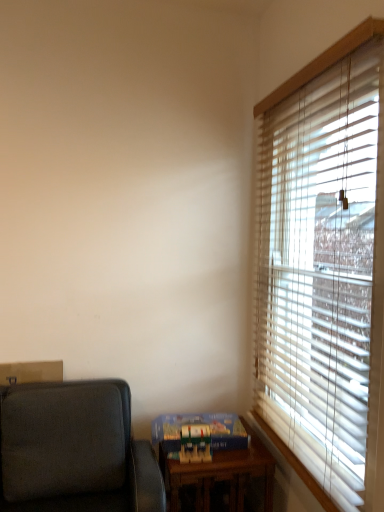
In order to click on wooden blinds at right in this screenshot , I will do `click(323, 268)`.

The image size is (384, 512). In order to click on dark gray fabric studio couch at lower left in this screenshot , I will do `click(74, 450)`.

You are a GUI agent. You are given a task and a screenshot of the screen. Output one action in this format:
    pyautogui.click(x=<x>, y=<y>)
    Task: Click on the wooden table at lower center
    
    Given the screenshot: What is the action you would take?
    pos(221,474)

The width and height of the screenshot is (384, 512). Find the location of `hardcover book at lower right, the 1th paperback book viewed from the front`. hardcover book at lower right, the 1th paperback book viewed from the front is located at coordinates (195, 443).

At what (x,y) coordinates should I click in order to perform the action: click on wooden blinds at right. Please return your answer as a coordinate pair (x, y). Looking at the image, I should click on (323, 268).

Based on their positions, is wooden blinds at right located to the left or right of hardcover book at lower right, placed as the 2th paperback book when sorted from back to front?

In the image, wooden blinds at right appears on the right side of hardcover book at lower right, placed as the 2th paperback book when sorted from back to front.

Is wooden blinds at right directly adjacent to hardcover book at lower right, the 1th paperback book viewed from the front?

No, wooden blinds at right is not with hardcover book at lower right, the 1th paperback book viewed from the front.

The height and width of the screenshot is (512, 384). I want to click on paperback book that is the 1st object located behind the wooden blinds at right, so click(x=195, y=443).

Between point (321, 286) and point (184, 462), which one is positioned in front?

The point (321, 286) is more forward.

Where is `paperback book that is the 2nd object located behind the wooden table at lower center`? paperback book that is the 2nd object located behind the wooden table at lower center is located at coordinates 200,423.

Can you tell me how much blue cardboard game set at lower center, the second paperback book viewed from the front, and wooden table at lower center differ in facing direction?

There is a 8.65e-05-degree angle between the facing directions of blue cardboard game set at lower center, the second paperback book viewed from the front, and wooden table at lower center.

Could you tell me if blue cardboard game set at lower center, marked as the first paperback book in a back-to-front arrangement, is turned towards wooden table at lower center?

No, blue cardboard game set at lower center, marked as the first paperback book in a back-to-front arrangement, does not turn towards wooden table at lower center.

From the image's perspective, who appears lower, blue cardboard game set at lower center, the second paperback book viewed from the front, or wooden table at lower center?

From the image's view, wooden table at lower center is below.

From the image's perspective, between dark gray fabric studio couch at lower left and wooden table at lower center, which one is located above?

dark gray fabric studio couch at lower left is shown above in the image.

Is wooden table at lower center inside dark gray fabric studio couch at lower left?

No.

Can you tell me how much dark gray fabric studio couch at lower left and wooden table at lower center differ in facing direction?

0.271 degrees.

Considering the sizes of objects dark gray fabric studio couch at lower left and wooden table at lower center in the image provided, who is wider, dark gray fabric studio couch at lower left or wooden table at lower center?

With larger width is wooden table at lower center.

Considering the sizes of wooden table at lower center and dark gray fabric studio couch at lower left in the image, is wooden table at lower center wider or thinner than dark gray fabric studio couch at lower left?

Considering their sizes, wooden table at lower center looks broader than dark gray fabric studio couch at lower left.

In the image, is wooden table at lower center on the left side or the right side of dark gray fabric studio couch at lower left?

Clearly, wooden table at lower center is on the right of dark gray fabric studio couch at lower left in the image.

From the image's perspective, is wooden table at lower center over dark gray fabric studio couch at lower left?

Actually, wooden table at lower center appears below dark gray fabric studio couch at lower left in the image.

Is hardcover book at lower right, the 1th paperback book viewed from the front, in front of blue cardboard game set at lower center, the second paperback book viewed from the front?

Yes, hardcover book at lower right, the 1th paperback book viewed from the front, is in front of blue cardboard game set at lower center, the second paperback book viewed from the front.

Is hardcover book at lower right, the 1th paperback book viewed from the front, touching blue cardboard game set at lower center, the second paperback book viewed from the front?

Yes, the surface of hardcover book at lower right, the 1th paperback book viewed from the front, is in contact with blue cardboard game set at lower center, the second paperback book viewed from the front.

From the image's perspective, is hardcover book at lower right, placed as the 2th paperback book when sorted from back to front, below blue cardboard game set at lower center, the second paperback book viewed from the front?

No, from the image's perspective, hardcover book at lower right, placed as the 2th paperback book when sorted from back to front, is not below blue cardboard game set at lower center, the second paperback book viewed from the front.

From the picture: Which object is thinner, hardcover book at lower right, the 1th paperback book viewed from the front, or blue cardboard game set at lower center, marked as the first paperback book in a back-to-front arrangement?

With smaller width is hardcover book at lower right, the 1th paperback book viewed from the front.

Which of these two, blue cardboard game set at lower center, the second paperback book viewed from the front, or hardcover book at lower right, placed as the 2th paperback book when sorted from back to front, stands shorter?

Standing shorter between the two is blue cardboard game set at lower center, the second paperback book viewed from the front.

Image resolution: width=384 pixels, height=512 pixels. I want to click on paperback book that appears in front of the blue cardboard game set at lower center, the second paperback book viewed from the front, so click(195, 443).

Does blue cardboard game set at lower center, marked as the first paperback book in a back-to-front arrangement, have a lesser width compared to hardcover book at lower right, placed as the 2th paperback book when sorted from back to front?

Incorrect, the width of blue cardboard game set at lower center, marked as the first paperback book in a back-to-front arrangement, is not less than that of hardcover book at lower right, placed as the 2th paperback book when sorted from back to front.

Does blue cardboard game set at lower center, marked as the first paperback book in a back-to-front arrangement, have a larger size compared to hardcover book at lower right, placed as the 2th paperback book when sorted from back to front?

Correct, blue cardboard game set at lower center, marked as the first paperback book in a back-to-front arrangement, is larger in size than hardcover book at lower right, placed as the 2th paperback book when sorted from back to front.

Between wooden table at lower center and blue cardboard game set at lower center, marked as the first paperback book in a back-to-front arrangement, which one appears on the left side from the viewer's perspective?

blue cardboard game set at lower center, marked as the first paperback book in a back-to-front arrangement, is more to the left.

From a real-world perspective, is wooden table at lower center physically located above or below blue cardboard game set at lower center, marked as the first paperback book in a back-to-front arrangement?

Clearly, from a real-world perspective, wooden table at lower center is below blue cardboard game set at lower center, marked as the first paperback book in a back-to-front arrangement.

Is wooden table at lower center positioned far away from blue cardboard game set at lower center, marked as the first paperback book in a back-to-front arrangement?

They are positioned close to each other.

From the image's perspective, which is above, wooden table at lower center or blue cardboard game set at lower center, marked as the first paperback book in a back-to-front arrangement?

blue cardboard game set at lower center, marked as the first paperback book in a back-to-front arrangement, from the image's perspective.

Locate an element on the screen. paperback book that is the 1st object located below the wooden blinds at right (from the image's perspective) is located at coordinates (195, 443).

Identify the location of the 2nd paperback book behind the wooden table at lower center. The width and height of the screenshot is (384, 512). (200, 423).

Which object lies further to the anchor point hardcover book at lower right, placed as the 2th paperback book when sorted from back to front, blue cardboard game set at lower center, marked as the first paperback book in a back-to-front arrangement, or dark gray fabric studio couch at lower left?

The object further to hardcover book at lower right, placed as the 2th paperback book when sorted from back to front, is dark gray fabric studio couch at lower left.

From the image, which object appears to be farther from wooden table at lower center, wooden blinds at right or hardcover book at lower right, placed as the 2th paperback book when sorted from back to front?

Based on the image, wooden blinds at right appears to be further to wooden table at lower center.

From the image, which object appears to be farther from blue cardboard game set at lower center, the second paperback book viewed from the front, hardcover book at lower right, placed as the 2th paperback book when sorted from back to front, or wooden table at lower center?

wooden table at lower center is further to blue cardboard game set at lower center, the second paperback book viewed from the front.

Looking at the image, which one is located closer to wooden table at lower center, hardcover book at lower right, placed as the 2th paperback book when sorted from back to front, or dark gray fabric studio couch at lower left?

hardcover book at lower right, placed as the 2th paperback book when sorted from back to front.

Which object lies further to the anchor point blue cardboard game set at lower center, the second paperback book viewed from the front, dark gray fabric studio couch at lower left or hardcover book at lower right, the 1th paperback book viewed from the front?

dark gray fabric studio couch at lower left.

Estimate the real-world distances between objects in this image. Which object is further from hardcover book at lower right, the 1th paperback book viewed from the front, wooden table at lower center or wooden blinds at right?

The object further to hardcover book at lower right, the 1th paperback book viewed from the front, is wooden blinds at right.

Considering their positions, is wooden table at lower center positioned closer to hardcover book at lower right, the 1th paperback book viewed from the front, than blue cardboard game set at lower center, marked as the first paperback book in a back-to-front arrangement?

The object closer to hardcover book at lower right, the 1th paperback book viewed from the front, is blue cardboard game set at lower center, marked as the first paperback book in a back-to-front arrangement.

Estimate the real-world distances between objects in this image. Which object is closer to wooden table at lower center, hardcover book at lower right, placed as the 2th paperback book when sorted from back to front, or blue cardboard game set at lower center, marked as the first paperback book in a back-to-front arrangement?

The object closer to wooden table at lower center is blue cardboard game set at lower center, marked as the first paperback book in a back-to-front arrangement.

The image size is (384, 512). Find the location of `paperback book that lies between wooden blinds at right and blue cardboard game set at lower center, the second paperback book viewed from the front, from top to bottom`. paperback book that lies between wooden blinds at right and blue cardboard game set at lower center, the second paperback book viewed from the front, from top to bottom is located at coordinates (195, 443).

Locate an element on the screen. paperback book between hardcover book at lower right, the 1th paperback book viewed from the front, and wooden table at lower center, in the vertical direction is located at coordinates (200, 423).

The height and width of the screenshot is (512, 384). I want to click on paperback book between dark gray fabric studio couch at lower left and blue cardboard game set at lower center, marked as the first paperback book in a back-to-front arrangement, in the horizontal direction, so click(195, 443).

Identify the location of studio couch between wooden blinds at right and wooden table at lower center in the up-down direction. The width and height of the screenshot is (384, 512). click(74, 450).